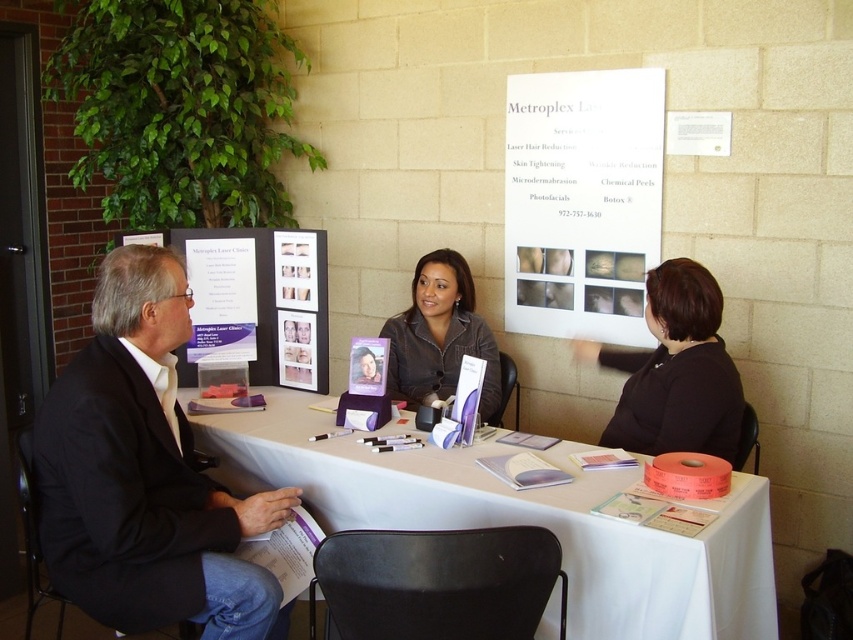
Between black suit at left and matte gray jacket at center, which one is positioned higher?

matte gray jacket at center is higher up.

Is black suit at left shorter than matte gray jacket at center?

No, black suit at left is not shorter than matte gray jacket at center.

Which is behind, point (165, 262) or point (434, 273)?

The point (434, 273) is more distant.

Image resolution: width=853 pixels, height=640 pixels. I want to click on black suit at left, so click(144, 474).

Is matte gray jacket at center taller than matte plastic photo frame at center?

Correct, matte gray jacket at center is much taller as matte plastic photo frame at center.

Is point (457, 292) closer to camera compared to point (376, 356)?

No, it is not.

Find the location of `matte gray jacket at center`. matte gray jacket at center is located at coordinates (439, 337).

Which is below, black suit at left or white paper at upper center?

black suit at left is lower down.

Is black suit at left smaller than white paper at upper center?

Actually, black suit at left might be larger than white paper at upper center.

Who is more distant from viewer, (53, 401) or (585, 186)?

The point (585, 186) is behind.

Where is `black suit at left`? The image size is (853, 640). black suit at left is located at coordinates [144, 474].